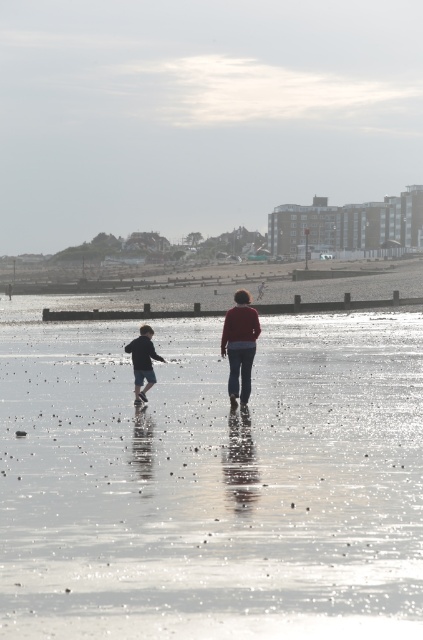
Which is in front, point (417, 525) or point (230, 324)?

Point (417, 525) is more forward.

Describe the element at coordinates (213, 483) in the screenshot. The height and width of the screenshot is (640, 423). I see `smooth sand beach at center` at that location.

The height and width of the screenshot is (640, 423). I want to click on smooth sand beach at center, so click(x=213, y=483).

The image size is (423, 640). What are the coordinates of `matte red sweater at center` in the screenshot? It's located at (239, 346).

Which is above, matte red sweater at center or dark blue denim shorts at left?

matte red sweater at center is higher up.

Does point (233, 308) lie in front of point (139, 344)?

Yes, point (233, 308) is in front of point (139, 344).

Find the location of a particular element. This screenshot has height=640, width=423. matte red sweater at center is located at coordinates (239, 346).

Is point (167, 468) closer to viewer compared to point (131, 346)?

Yes.

Is smooth sand beach at center further to camera compared to dark blue denim shorts at left?

That is False.

Where is `smooth sand beach at center`? This screenshot has height=640, width=423. smooth sand beach at center is located at coordinates (213, 483).